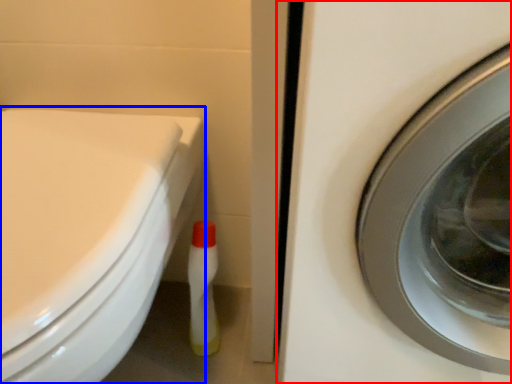
Question: Among these objects, which one is farthest to the camera, washing machine (highlighted by a red box) or bidet (highlighted by a blue box)?

Choices:
 (A) washing machine
 (B) bidet

Answer: (B)